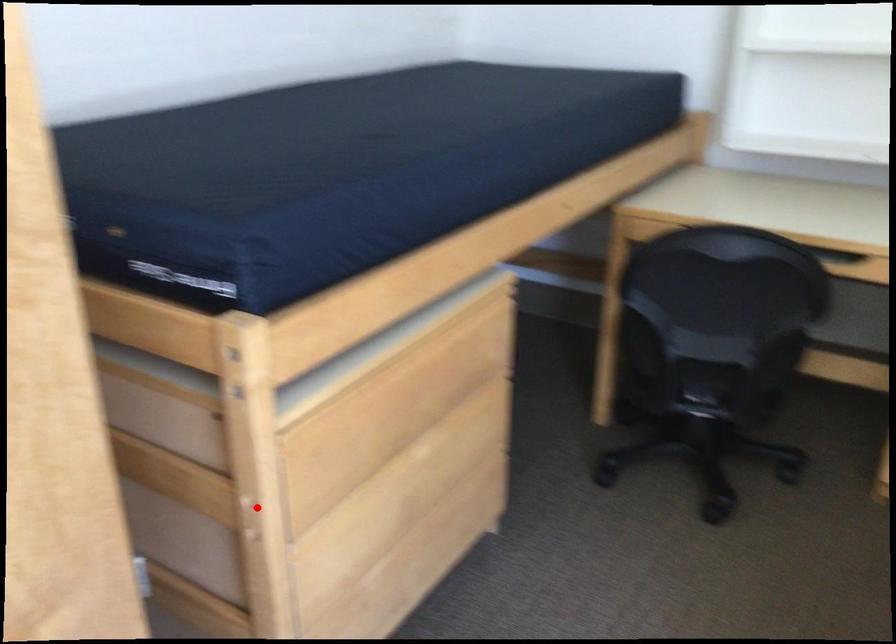
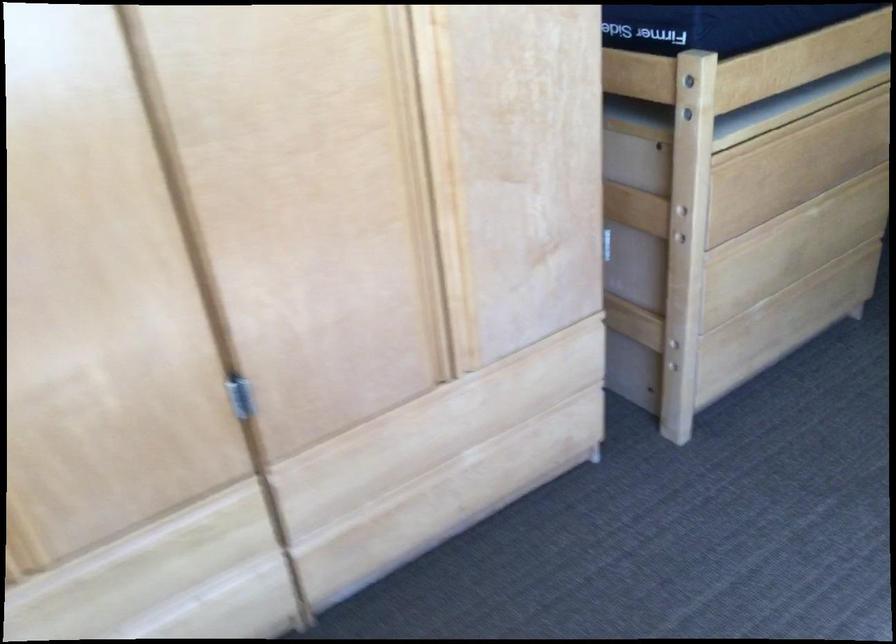
Find the pixel in the second image that matches the highlighted location in the first image.

(682, 210)